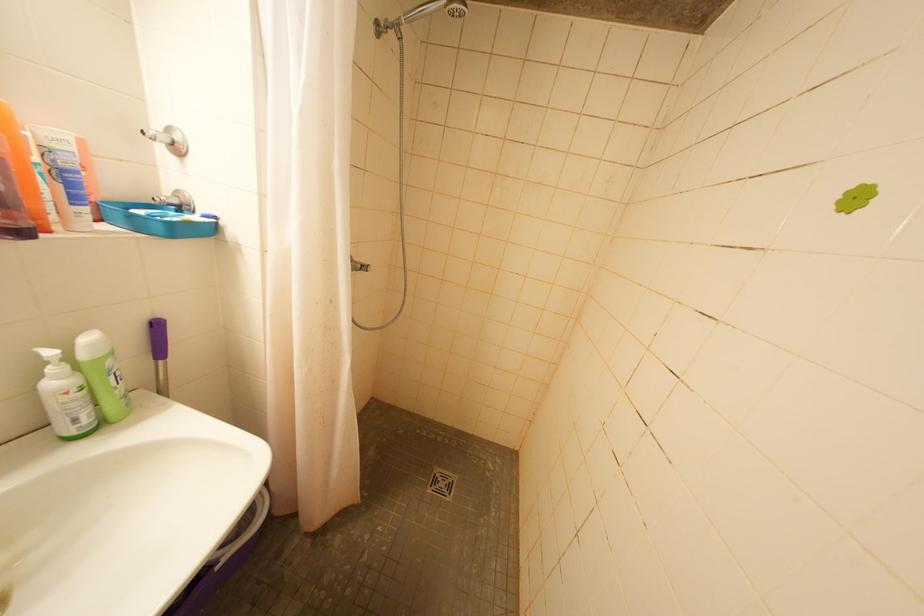
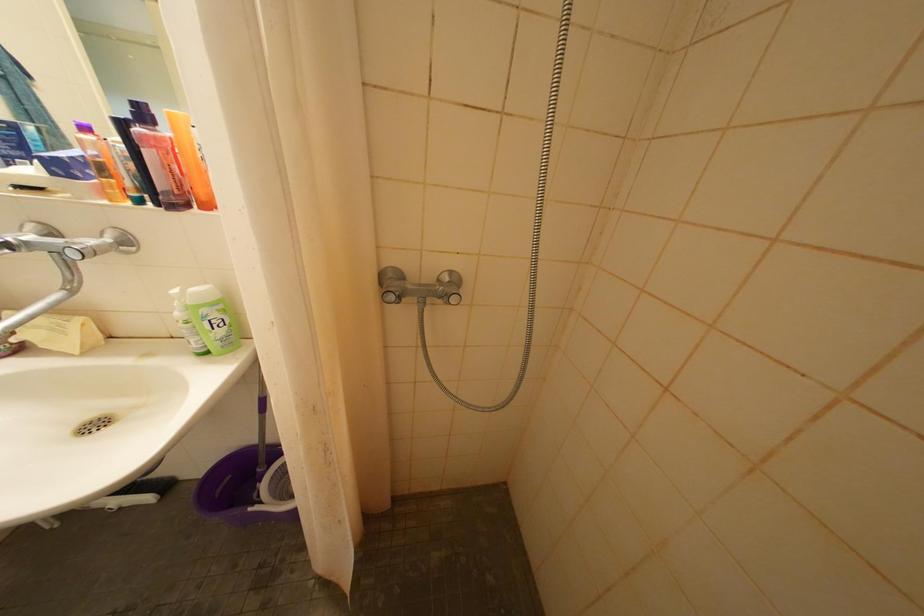
Question: Based on the continuous images, in which direction is the camera rotating? Reply with the corresponding letter.

Choices:
 (A) Left
 (B) Right
 (C) Up
 (D) Down

Answer: (A)